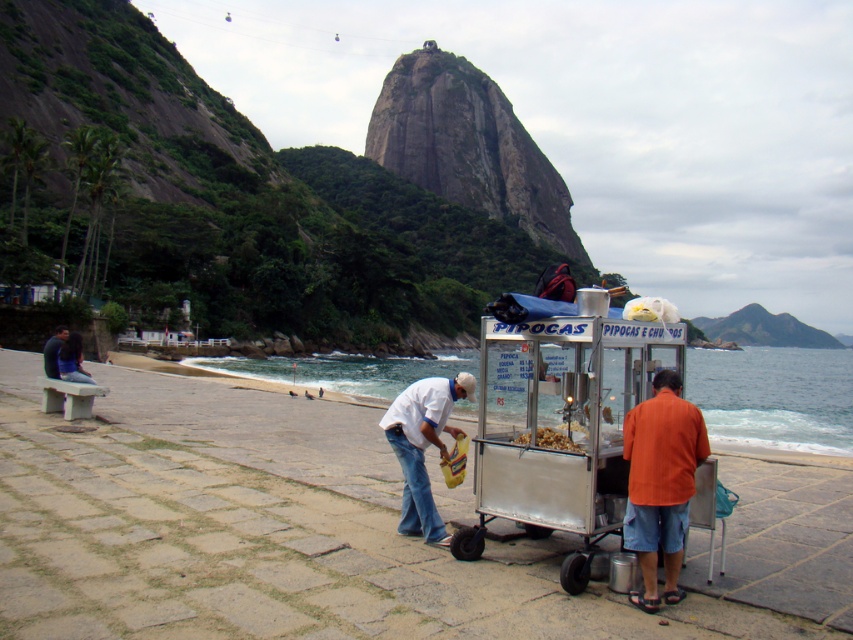
You are a tourist walking along the seaside promenade and see the smooth sand at lower center and the golden crispy popcorn at center. Which object is closer to you as you face the scene?

The smooth sand at lower center is closer to you because it is in front of the golden crispy popcorn at center.